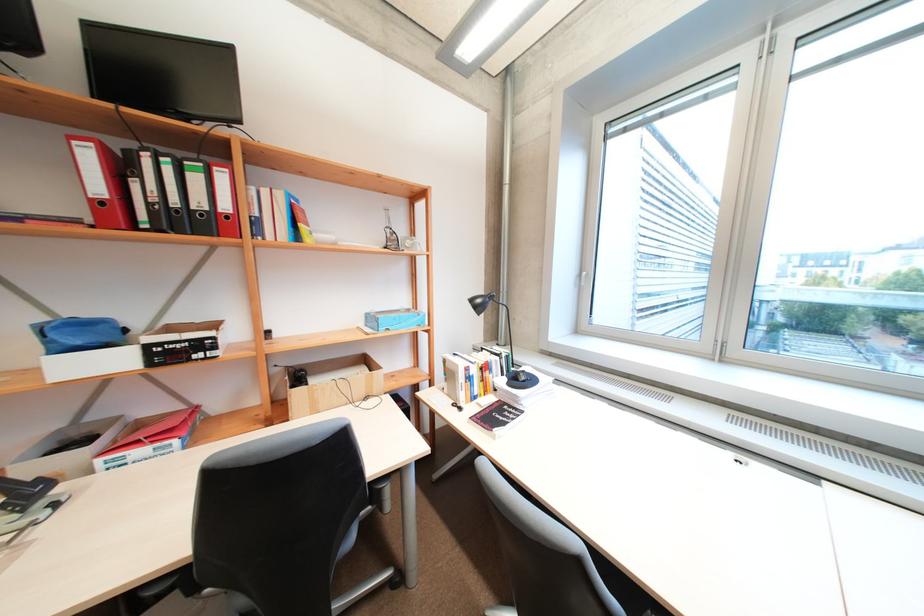
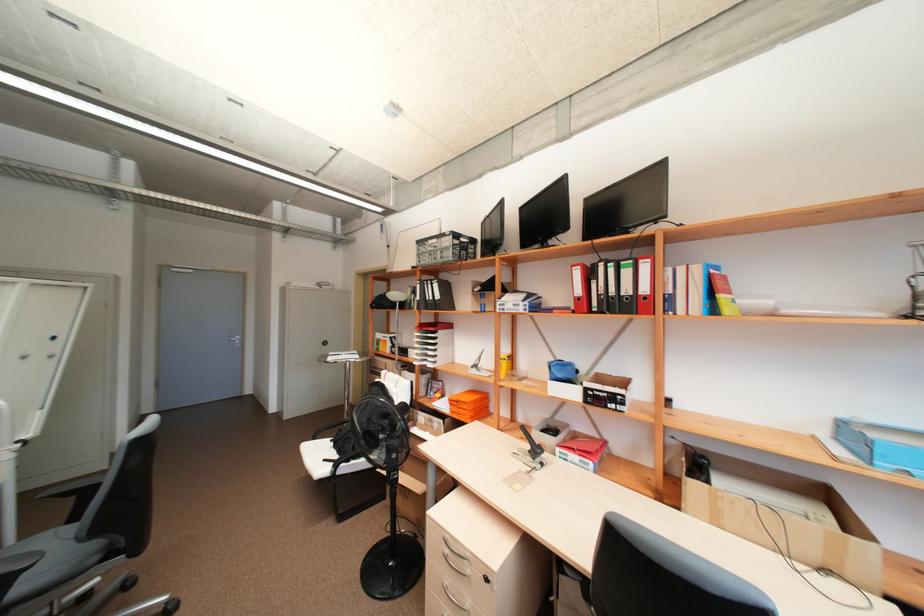
Locate, in the second image, the point that corresponds to the point at 297,387 in the first image.

(695, 475)